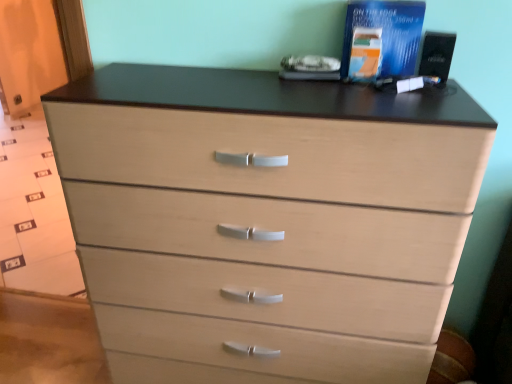
This screenshot has height=384, width=512. What do you see at coordinates (365, 54) in the screenshot? I see `blue paper at upper right, the second book in the right-to-left sequence` at bounding box center [365, 54].

Identify the location of blue paper at upper right, the second book in the right-to-left sequence. The height and width of the screenshot is (384, 512). (365, 54).

What do you see at coordinates (387, 32) in the screenshot?
I see `blue matte book at upper right, which is the 2th book from left to right` at bounding box center [387, 32].

Find the location of `blue matte book at upper right, the first book positioned from the right`. blue matte book at upper right, the first book positioned from the right is located at coordinates (387, 32).

The image size is (512, 384). What are the coordinates of `blue paper at upper right, the first book from the left` in the screenshot? It's located at (365, 54).

Which object is positioned more to the right, blue paper at upper right, the second book in the right-to-left sequence, or blue matte book at upper right, the first book positioned from the right?

Positioned to the right is blue matte book at upper right, the first book positioned from the right.

Does blue paper at upper right, the second book in the right-to-left sequence, come in front of blue matte book at upper right, which is the 2th book from left to right?

No, blue paper at upper right, the second book in the right-to-left sequence, is behind blue matte book at upper right, which is the 2th book from left to right.

Considering the positions of point (374, 35) and point (346, 58), is point (374, 35) closer or farther from the camera than point (346, 58)?

Clearly, point (374, 35) is closer to the camera than point (346, 58).

From the image's perspective, is blue paper at upper right, the first book from the left, located beneath blue matte book at upper right, the first book positioned from the right?

Correct, blue paper at upper right, the first book from the left, appears lower than blue matte book at upper right, the first book positioned from the right, in the image.

From a real-world perspective, is blue paper at upper right, the first book from the left, located beneath blue matte book at upper right, the first book positioned from the right?

Yes, from a real-world perspective, blue paper at upper right, the first book from the left, is below blue matte book at upper right, the first book positioned from the right.

Based on the photo, which object is wider, blue paper at upper right, the second book in the right-to-left sequence, or blue matte book at upper right, which is the 2th book from left to right?

blue matte book at upper right, which is the 2th book from left to right.

Who is taller, blue paper at upper right, the second book in the right-to-left sequence, or blue matte book at upper right, the first book positioned from the right?

blue matte book at upper right, the first book positioned from the right, is taller.

Considering the relative sizes of blue paper at upper right, the second book in the right-to-left sequence, and blue matte book at upper right, which is the 2th book from left to right, in the image provided, is blue paper at upper right, the second book in the right-to-left sequence, smaller than blue matte book at upper right, which is the 2th book from left to right,?

Yes.

Would you say blue paper at upper right, the second book in the right-to-left sequence, contains blue matte book at upper right, which is the 2th book from left to right?

Actually, blue matte book at upper right, which is the 2th book from left to right, is outside blue paper at upper right, the second book in the right-to-left sequence.

Would you consider blue paper at upper right, the first book from the left, to be distant from blue matte book at upper right, the first book positioned from the right?

blue paper at upper right, the first book from the left, is actually quite close to blue matte book at upper right, the first book positioned from the right.

Does blue paper at upper right, the first book from the left, turn towards blue matte book at upper right, the first book positioned from the right?

No, blue paper at upper right, the first book from the left, is not oriented towards blue matte book at upper right, the first book positioned from the right.

What's the angular difference between blue paper at upper right, the first book from the left, and blue matte book at upper right, which is the 2th book from left to right,'s facing directions?

There is a 7.36e-05-degree angle between the facing directions of blue paper at upper right, the first book from the left, and blue matte book at upper right, which is the 2th book from left to right.

Locate an element on the screen. This screenshot has height=384, width=512. book on the right of blue paper at upper right, the first book from the left is located at coordinates (x=387, y=32).

In the image, is blue matte book at upper right, which is the 2th book from left to right, on the left side or the right side of blue paper at upper right, the first book from the left?

Based on their positions, blue matte book at upper right, which is the 2th book from left to right, is located to the right of blue paper at upper right, the first book from the left.

Considering the relative positions of blue matte book at upper right, the first book positioned from the right, and blue paper at upper right, the second book in the right-to-left sequence, in the image provided, is blue matte book at upper right, the first book positioned from the right, in front of blue paper at upper right, the second book in the right-to-left sequence,?

That is True.

Does point (349, 23) come farther from viewer compared to point (370, 37)?

Yes, point (349, 23) is behind point (370, 37).

From the image's perspective, relative to blue paper at upper right, the first book from the left, is blue matte book at upper right, which is the 2th book from left to right, above or below?

blue matte book at upper right, which is the 2th book from left to right, is above blue paper at upper right, the first book from the left.

From a real-world perspective, between blue matte book at upper right, which is the 2th book from left to right, and blue paper at upper right, the first book from the left, who is vertically lower?

blue paper at upper right, the first book from the left, is physically lower.

From the picture: Which object is thinner, blue matte book at upper right, which is the 2th book from left to right, or blue paper at upper right, the second book in the right-to-left sequence?

blue paper at upper right, the second book in the right-to-left sequence.

Who is taller, blue matte book at upper right, which is the 2th book from left to right, or blue paper at upper right, the second book in the right-to-left sequence?

blue matte book at upper right, which is the 2th book from left to right, is taller.

Considering the sizes of objects blue matte book at upper right, the first book positioned from the right, and blue paper at upper right, the first book from the left, in the image provided, who is bigger, blue matte book at upper right, the first book positioned from the right, or blue paper at upper right, the first book from the left,?

Bigger between the two is blue matte book at upper right, the first book positioned from the right.

Is blue matte book at upper right, which is the 2th book from left to right, positioned beyond the bounds of blue paper at upper right, the second book in the right-to-left sequence?

That's correct, blue matte book at upper right, which is the 2th book from left to right, is outside of blue paper at upper right, the second book in the right-to-left sequence.

Is blue matte book at upper right, the first book positioned from the right, positioned far away from blue paper at upper right, the second book in the right-to-left sequence?

No, blue matte book at upper right, the first book positioned from the right, is not far from blue paper at upper right, the second book in the right-to-left sequence.

Is blue matte book at upper right, the first book positioned from the right, oriented away from blue paper at upper right, the first book from the left?

Yes, blue matte book at upper right, the first book positioned from the right, is positioned with its back facing blue paper at upper right, the first book from the left.

From the picture: How different are the orientations of blue matte book at upper right, the first book positioned from the right, and blue paper at upper right, the second book in the right-to-left sequence, in degrees?

The angular difference between blue matte book at upper right, the first book positioned from the right, and blue paper at upper right, the second book in the right-to-left sequence, is 7.36e-05 degrees.

The image size is (512, 384). In order to click on book below the blue matte book at upper right, which is the 2th book from left to right (from a real-world perspective) in this screenshot , I will do `click(365, 54)`.

Locate an element on the screen. book that is behind the blue matte book at upper right, which is the 2th book from left to right is located at coordinates (365, 54).

Find the location of a particular element. The width and height of the screenshot is (512, 384). book that appears below the blue matte book at upper right, the first book positioned from the right (from a real-world perspective) is located at coordinates (365, 54).